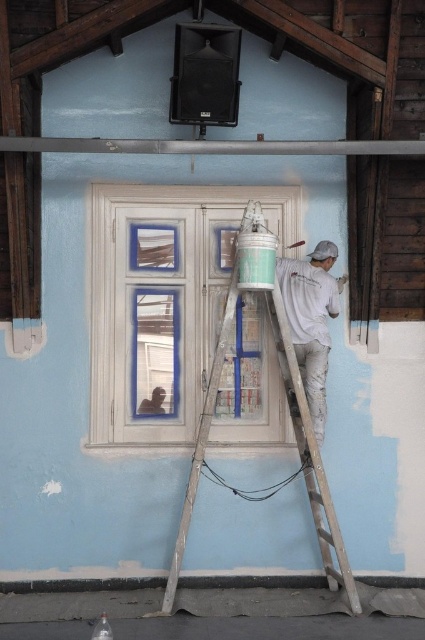
Does white matte shirt at right have a lesser height compared to metallic gray beam at upper center?

In fact, white matte shirt at right may be taller than metallic gray beam at upper center.

Based on the photo, can you confirm if white matte shirt at right is bigger than metallic gray beam at upper center?

Yes, white matte shirt at right is bigger than metallic gray beam at upper center.

Which is in front, point (300, 346) or point (85, 150)?

Point (85, 150) is in front.

In order to click on white matte shirt at right in this screenshot , I will do `click(311, 321)`.

Which is below, white painted wood at center or wooden ladder at center?

wooden ladder at center

Image resolution: width=425 pixels, height=640 pixels. Describe the element at coordinates (164, 300) in the screenshot. I see `white painted wood at center` at that location.

This screenshot has width=425, height=640. Identify the location of white painted wood at center. (164, 300).

Find the location of a particular element. white painted wood at center is located at coordinates (164, 300).

Is wooden ladder at center shorter than metallic gray beam at upper center?

Incorrect, wooden ladder at center's height does not fall short of metallic gray beam at upper center's.

Which is in front, point (289, 380) or point (368, 141)?

Point (368, 141) is more forward.

Image resolution: width=425 pixels, height=640 pixels. In order to click on wooden ladder at center in this screenshot , I will do `click(311, 452)`.